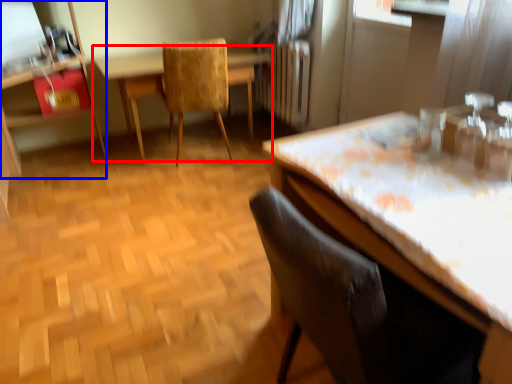
Question: Which object is closer to the camera taking this photo, table (highlighted by a red box) or dresser (highlighted by a blue box)?

Choices:
 (A) table
 (B) dresser

Answer: (B)